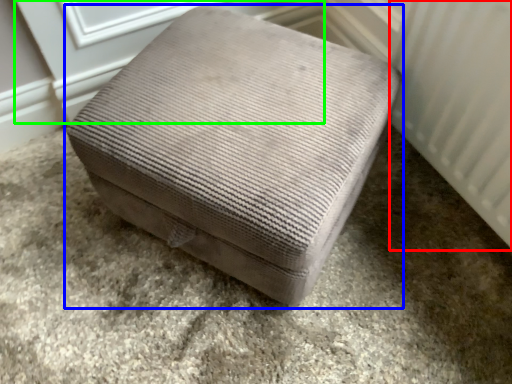
Question: Considering the real-world distances, which object is closest to radiator (highlighted by a red box)? furniture (highlighted by a blue box) or screen door (highlighted by a green box).

Choices:
 (A) furniture
 (B) screen door

Answer: (A)